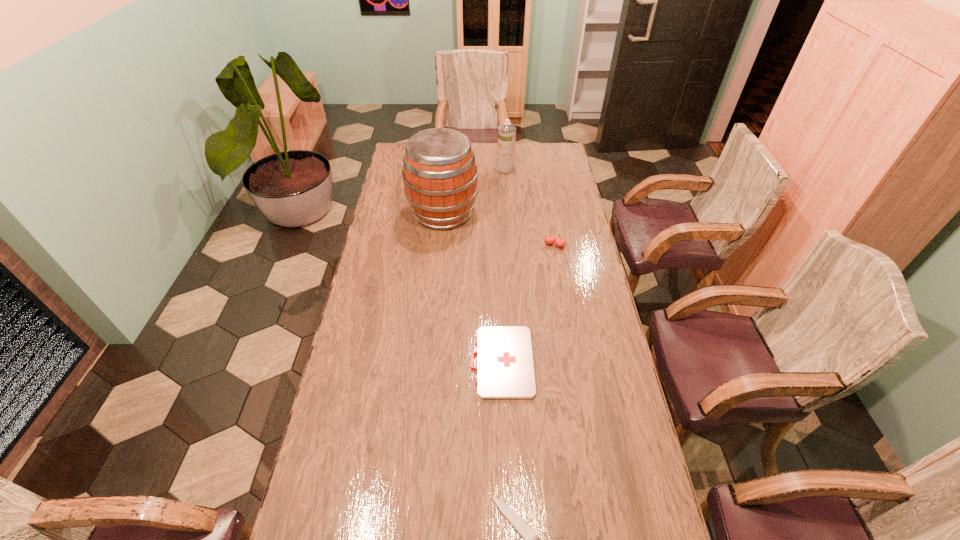
The image size is (960, 540). I want to click on free space located on the left of the third farthest object, so click(461, 245).

Locate an element on the screen. vacant space located on handle side the first-aid kit is located at coordinates (349, 362).

This screenshot has height=540, width=960. Find the location of `blank space located on handle side the first-aid kit`. blank space located on handle side the first-aid kit is located at coordinates (392, 362).

This screenshot has height=540, width=960. In order to click on vacant position located 0.200m on handle side the first-aid kit in this screenshot , I will do `click(410, 362)`.

Find the location of `object present at the far edge`. object present at the far edge is located at coordinates (506, 141).

The image size is (960, 540). In order to click on object located in the left edge section of the desktop in this screenshot , I will do `click(440, 175)`.

You are a GUI agent. You are given a task and a screenshot of the screen. Output one action in this format:
    pyautogui.click(x=<x>, y=<y>)
    Task: Click on the object that is at the right edge
    
    Given the screenshot: What is the action you would take?
    pyautogui.click(x=560, y=242)

In order to click on vacant space at the left edge of the desktop in this screenshot , I will do `click(375, 403)`.

Where is `vacant space at the right edge of the desktop`? vacant space at the right edge of the desktop is located at coordinates (595, 276).

In the image, there is a desktop. In order to click on free space at the far right corner in this screenshot , I will do `click(534, 148)`.